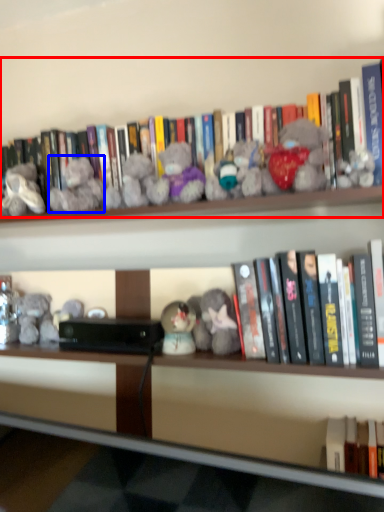
Question: Which object is closer to the camera taking this photo, book (highlighted by a red box) or toy (highlighted by a blue box)?

Choices:
 (A) book
 (B) toy

Answer: (A)